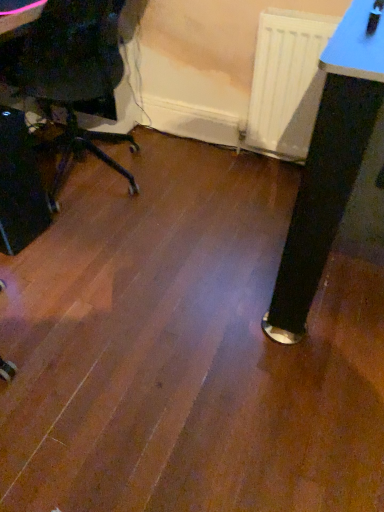
Find the location of `black plastic computer tower at left`. black plastic computer tower at left is located at coordinates (19, 186).

What is the approximate height of black plastic computer tower at left?

20.61 inches.

Measure the distance between black plastic computer tower at left and camera.

1.45 meters.

The height and width of the screenshot is (512, 384). What do you see at coordinates (19, 186) in the screenshot?
I see `black plastic computer tower at left` at bounding box center [19, 186].

I want to click on white matte radiator at center, so click(286, 82).

The image size is (384, 512). What do you see at coordinates (286, 82) in the screenshot? I see `white matte radiator at center` at bounding box center [286, 82].

Image resolution: width=384 pixels, height=512 pixels. I want to click on black plastic computer tower at left, so click(x=19, y=186).

Consider the image. Which is more to the left, black plastic computer tower at left or white matte radiator at center?

black plastic computer tower at left is more to the left.

Considering their positions, is black plastic computer tower at left located in front of or behind white matte radiator at center?

black plastic computer tower at left is in front of white matte radiator at center.

Does point (31, 239) lie in front of point (329, 19)?

No, it is behind (329, 19).

From the image's perspective, is black plastic computer tower at left located above white matte radiator at center?

No, from the image's perspective, black plastic computer tower at left is not above white matte radiator at center.

From a real-world perspective, is black plastic computer tower at left located higher than white matte radiator at center?

No.

Considering the sizes of objects black plastic computer tower at left and white matte radiator at center in the image provided, who is wider, black plastic computer tower at left or white matte radiator at center?

With larger width is black plastic computer tower at left.

Does black plastic computer tower at left have a greater height compared to white matte radiator at center?

Incorrect, the height of black plastic computer tower at left is not larger of that of white matte radiator at center.

Who is bigger, black plastic computer tower at left or white matte radiator at center?

Bigger between the two is black plastic computer tower at left.

Is white matte radiator at center surrounded by black plastic computer tower at left?

No, white matte radiator at center is located outside of black plastic computer tower at left.

Are black plastic computer tower at left and white matte radiator at center making contact?

No, black plastic computer tower at left is not making contact with white matte radiator at center.

Could you tell me if black plastic computer tower at left is turned towards white matte radiator at center?

No.

How many degrees apart are the facing directions of black plastic computer tower at left and white matte radiator at center?

86.7 degrees.

How distant is black plastic computer tower at left from white matte radiator at center?

A distance of 1.11 meters exists between black plastic computer tower at left and white matte radiator at center.

The height and width of the screenshot is (512, 384). I want to click on radiator behind the black plastic computer tower at left, so click(286, 82).

Considering the relative positions of white matte radiator at center and black plastic computer tower at left in the image provided, is white matte radiator at center to the right of black plastic computer tower at left from the viewer's perspective?

Indeed, white matte radiator at center is positioned on the right side of black plastic computer tower at left.

Does white matte radiator at center lie in front of black plastic computer tower at left?

That is False.

Between point (250, 116) and point (43, 202), which one is positioned behind?

The point (250, 116) is behind.

From the image's perspective, which one is positioned higher, white matte radiator at center or black plastic computer tower at left?

white matte radiator at center is shown above in the image.

From a real-world perspective, which object rests below the other?

black plastic computer tower at left, from a real-world perspective.

Considering the sizes of objects white matte radiator at center and black plastic computer tower at left in the image provided, who is wider, white matte radiator at center or black plastic computer tower at left?

black plastic computer tower at left is wider.

Is white matte radiator at center taller or shorter than black plastic computer tower at left?

In the image, white matte radiator at center appears to be taller than black plastic computer tower at left.

Considering the relative sizes of white matte radiator at center and black plastic computer tower at left in the image provided, is white matte radiator at center bigger than black plastic computer tower at left?

Actually, white matte radiator at center might be smaller than black plastic computer tower at left.

Is white matte radiator at center surrounding black plastic computer tower at left?

No, white matte radiator at center does not contain black plastic computer tower at left.

Is white matte radiator at center with black plastic computer tower at left?

No, white matte radiator at center is not next to black plastic computer tower at left.

Is white matte radiator at center facing away from black plastic computer tower at left?

No.

How much distance is there between white matte radiator at center and black plastic computer tower at left?

white matte radiator at center and black plastic computer tower at left are 1.11 meters apart.

This screenshot has height=512, width=384. I want to click on computer tower that is under the white matte radiator at center (from a real-world perspective), so click(19, 186).

Identify the location of computer tower beneath the white matte radiator at center (from a real-world perspective). This screenshot has width=384, height=512. (19, 186).

Locate an element on the screen. radiator behind the black plastic computer tower at left is located at coordinates (286, 82).